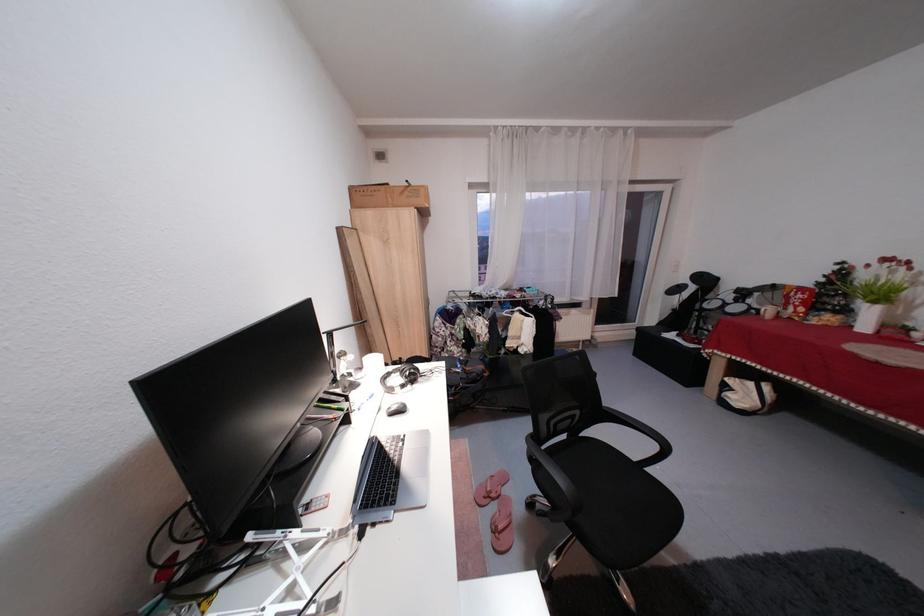
Image resolution: width=924 pixels, height=616 pixels. I want to click on white cylindrical lamp, so click(x=335, y=344).